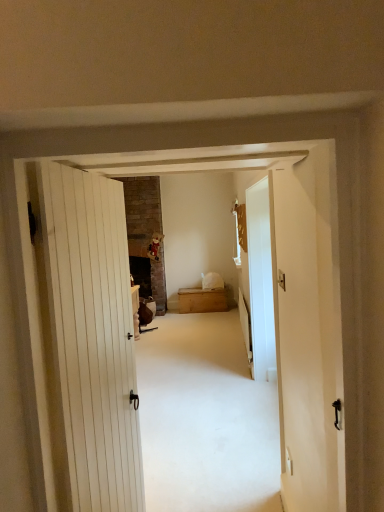
Question: Considering the relative sizes of transparent glass door at right and wooden chest at center in the image provided, is transparent glass door at right shorter than wooden chest at center?

Choices:
 (A) yes
 (B) no

Answer: (B)

Question: Can you confirm if transparent glass door at right is positioned to the left of wooden chest at center?

Choices:
 (A) yes
 (B) no

Answer: (B)

Question: Can you confirm if transparent glass door at right is thinner than wooden chest at center?

Choices:
 (A) no
 (B) yes

Answer: (B)

Question: From the image's perspective, would you say transparent glass door at right is shown under wooden chest at center?

Choices:
 (A) no
 (B) yes

Answer: (A)

Question: Does transparent glass door at right appear on the right side of wooden chest at center?

Choices:
 (A) yes
 (B) no

Answer: (A)

Question: From a real-world perspective, does transparent glass door at right sit lower than wooden chest at center?

Choices:
 (A) yes
 (B) no

Answer: (B)

Question: Is wooden chest at center at the right side of transparent glass door at right?

Choices:
 (A) yes
 (B) no

Answer: (B)

Question: From a real-world perspective, is wooden chest at center under transparent glass door at right?

Choices:
 (A) yes
 (B) no

Answer: (A)

Question: Is the position of wooden chest at center more distant than that of transparent glass door at right?

Choices:
 (A) no
 (B) yes

Answer: (B)

Question: Can we say wooden chest at center lies outside transparent glass door at right?

Choices:
 (A) no
 (B) yes

Answer: (B)

Question: Considering the relative sizes of wooden chest at center and transparent glass door at right in the image provided, is wooden chest at center taller than transparent glass door at right?

Choices:
 (A) no
 (B) yes

Answer: (A)

Question: Is wooden chest at center positioned in front of transparent glass door at right?

Choices:
 (A) no
 (B) yes

Answer: (A)

Question: From a real-world perspective, relative to transparent glass door at right, is wooden chest at center vertically above or below?

Choices:
 (A) below
 (B) above

Answer: (A)